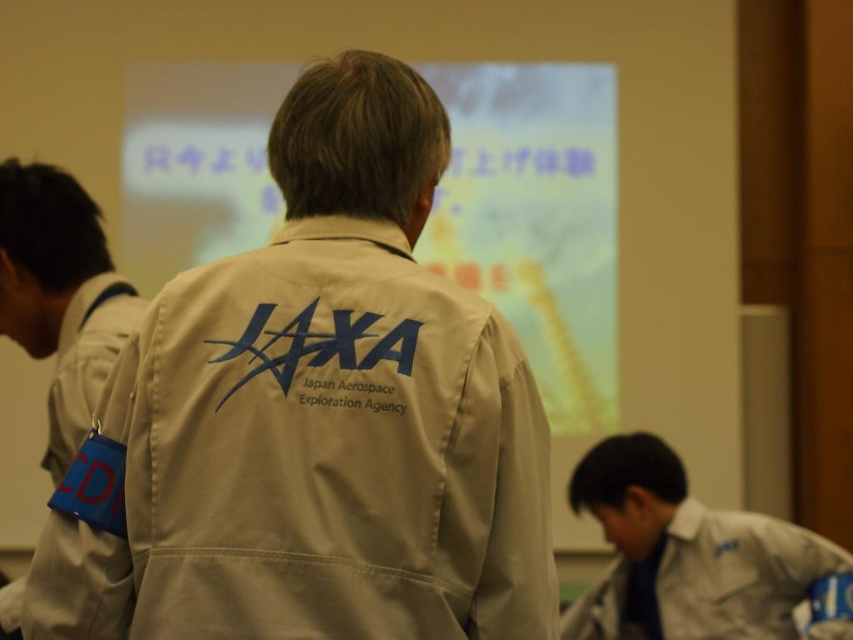
Question: Does matte white projection screen at center appear on the right side of beige fabric uniform at lower right?

Choices:
 (A) no
 (B) yes

Answer: (A)

Question: Can you confirm if matte white projection screen at center is positioned above beige fabric jaxa jacket at center?

Choices:
 (A) yes
 (B) no

Answer: (A)

Question: Which object appears farthest from the camera in this image?

Choices:
 (A) beige fabric lab coat at center
 (B) beige fabric jaxa jacket at center

Answer: (B)

Question: Considering the real-world distances, which object is closest to the matte white projection screen at center?

Choices:
 (A) beige fabric jaxa jacket at center
 (B) beige fabric uniform at lower right
 (C) beige fabric lab coat at center

Answer: (B)

Question: Does beige fabric lab coat at center have a larger size compared to beige fabric uniform at lower right?

Choices:
 (A) no
 (B) yes

Answer: (A)

Question: Which point is closer to the camera taking this photo?

Choices:
 (A) (186, 106)
 (B) (579, 492)

Answer: (B)